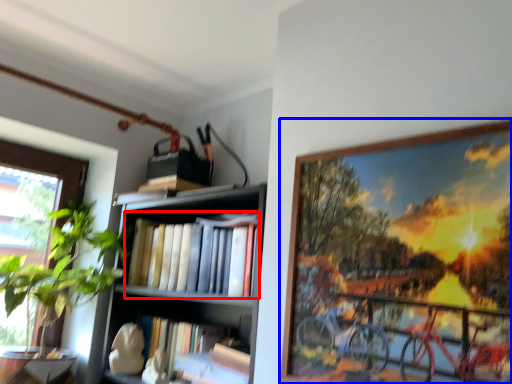
Question: Which object appears closest to the camera in this image, book (highlighted by a red box) or picture frame (highlighted by a blue box)?

Choices:
 (A) book
 (B) picture frame

Answer: (B)